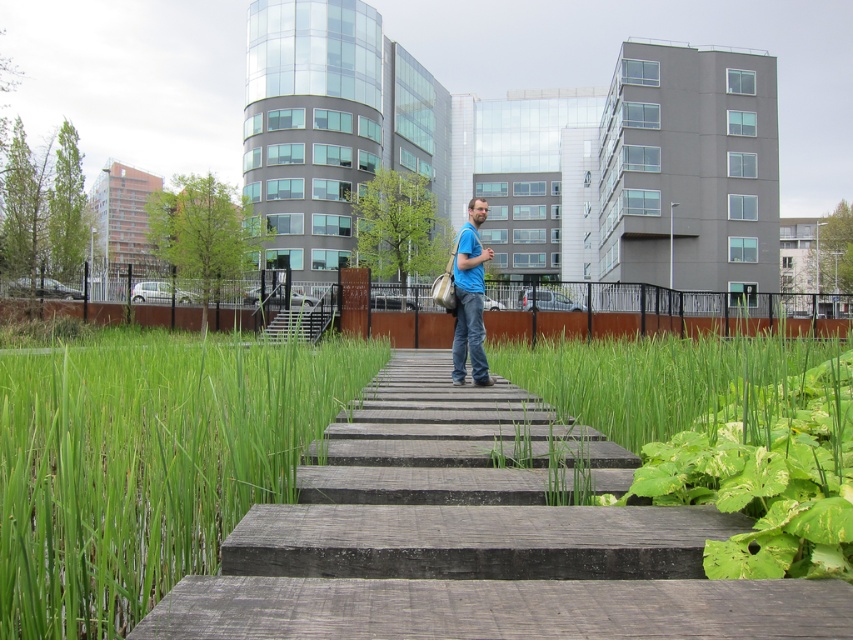
You are standing on the wooden walkway in the midground and see both the green grass at center and the blue fabric bag at center. Which object is closer to you?

The green grass at center is closer to you because it is in front of the blue fabric bag at center.

You are a delivery person carrying a package that requires a clear path of at least 4 meters between the green grass at center and wooden stairs at center. Can you safely navigate through the space between them?

The distance between the green grass at center and wooden stairs at center is 3.50 meters, which is less than the required 4 meters. Therefore, you cannot safely navigate through the space between them.

You are a landscape architect designing a garden between the green grass at center and the green leafy grass at center. What is the minimum length of a garden path you need to create to connect them?

The minimum length of the garden path needed to connect the green grass at center and the green leafy grass at center is 16.59 feet, as that is the distance between them.